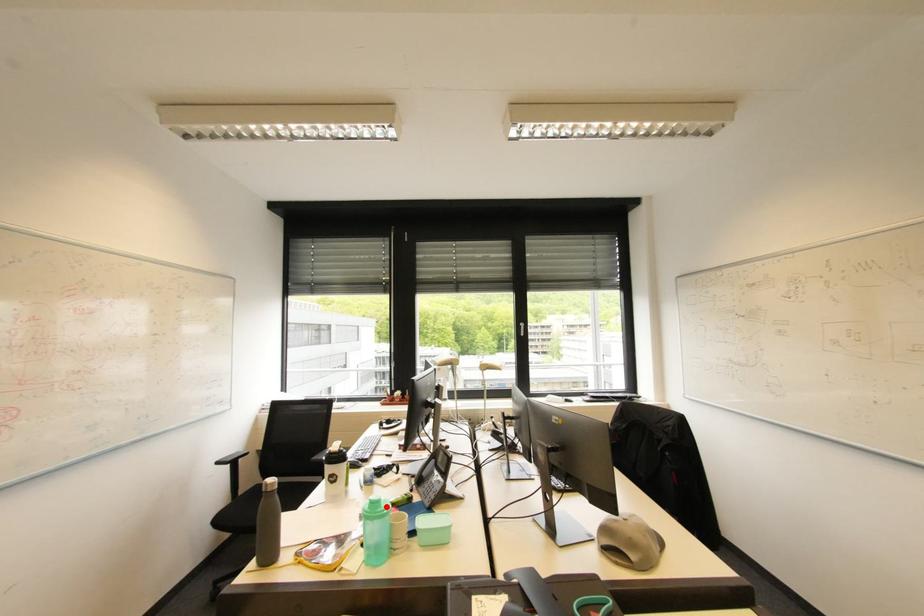
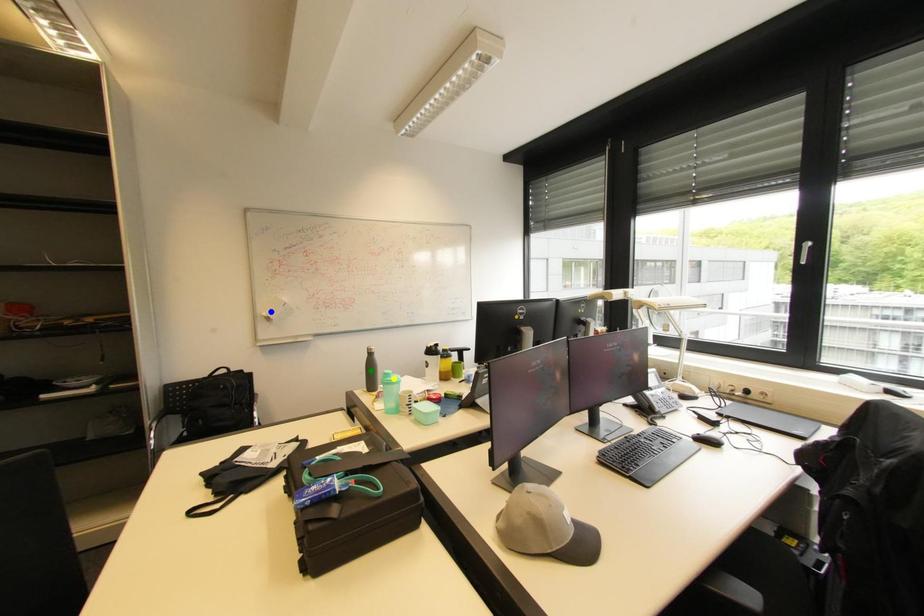
Question: I am providing you with two images of the same scene from different viewpoints. A red point is marked on the first image. You are given multiple points on the second image. Which spot in image 2 lines up with the point in image 1?

Choices:
 (A) blue point
 (B) yellow point
 (C) green point

Answer: (B)